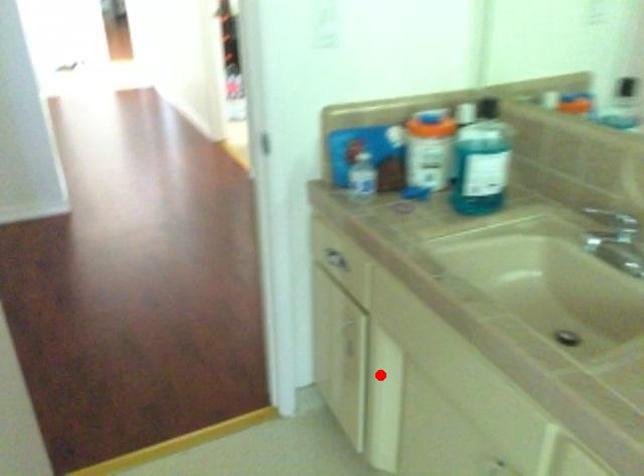
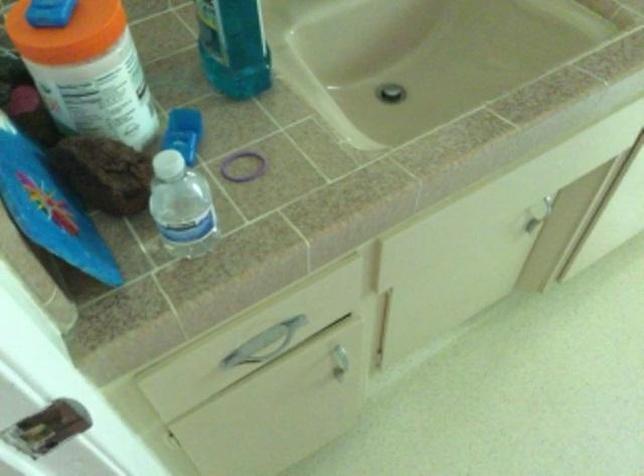
Question: A red point is marked in image1. In image2, is the corresponding 3D point closer to the camera or farther? Reply with the corresponding letter.

Choices:
 (A) The corresponding 3D point is closer.
 (B) The corresponding 3D point is farther.

Answer: (A)